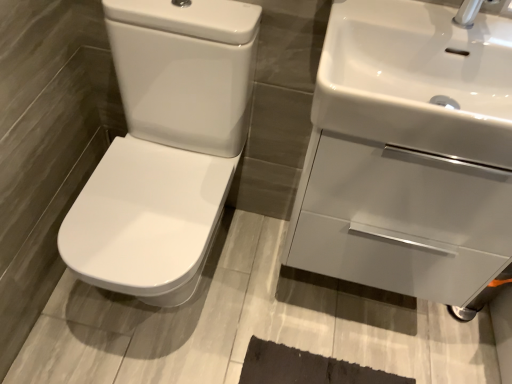
This screenshot has height=384, width=512. What are the coordinates of `free region under white glossy sink at upper right, the 2th sink viewed from the front (from a real-world perspective)` in the screenshot? It's located at (347, 296).